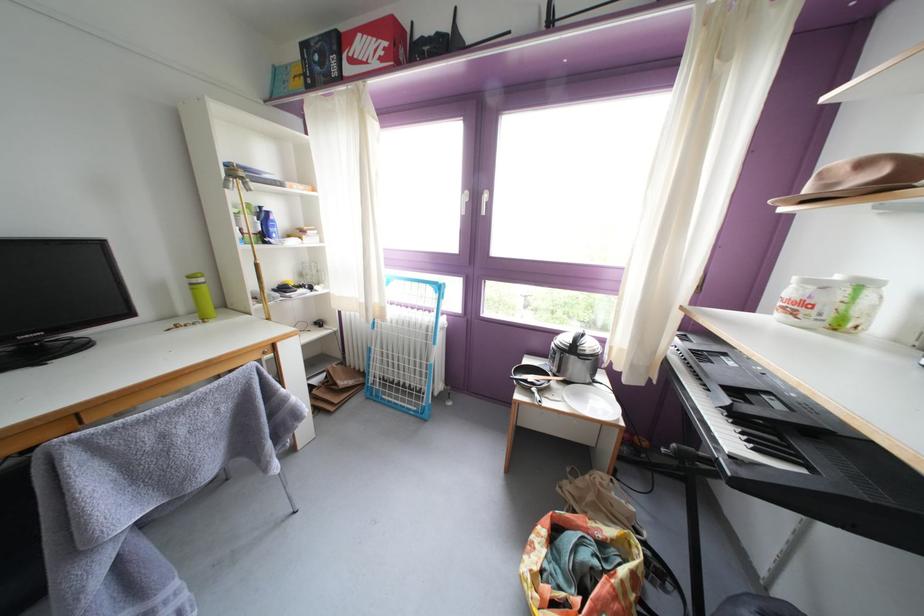
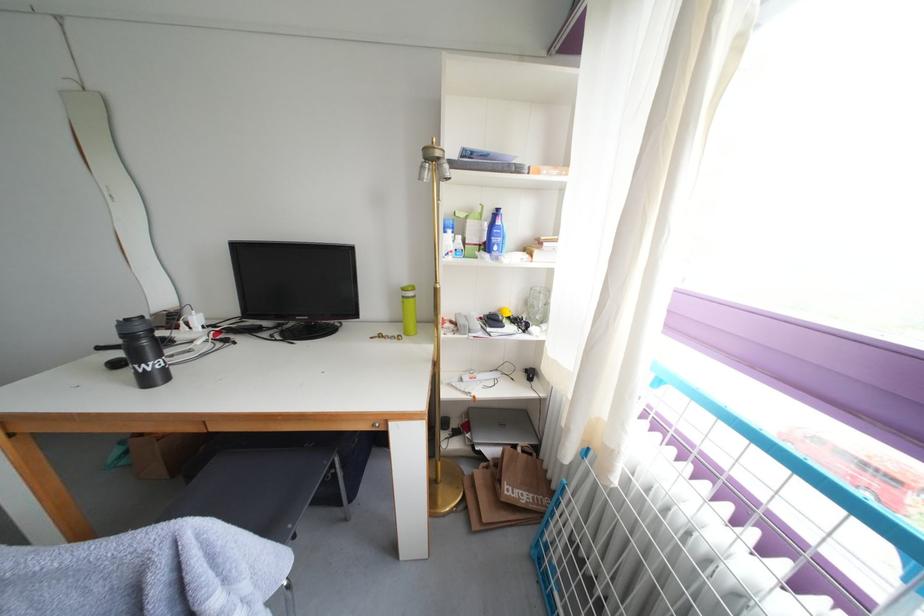
In the second image, find the point that corresponds to (311,281) in the first image.

(537, 309)